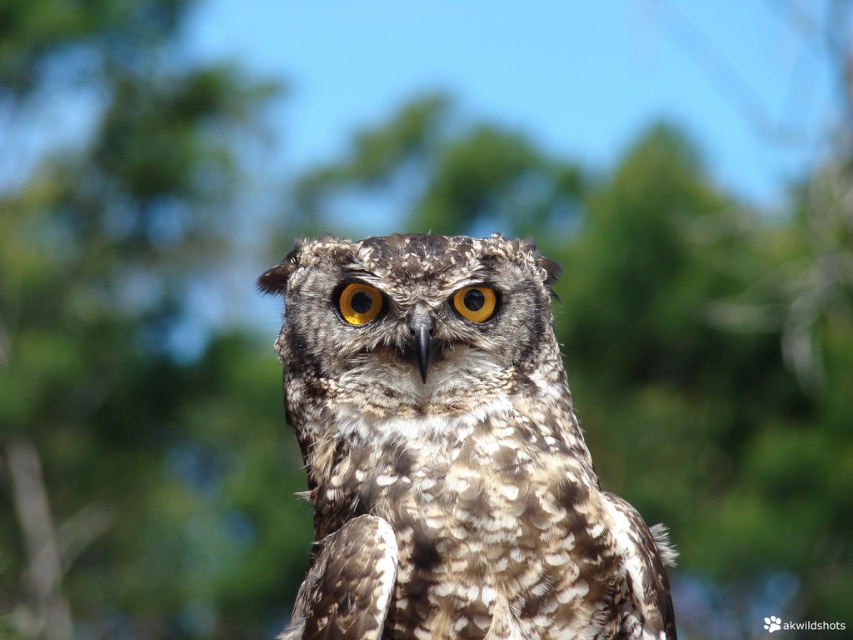
Between speckled feathered owl at center and golden matte eye at center, which one appears on the left side from the viewer's perspective?

golden matte eye at center is more to the left.

Which is in front, point (518, 365) or point (346, 301)?

Point (518, 365) is in front.

The width and height of the screenshot is (853, 640). I want to click on speckled feathered owl at center, so click(x=451, y=454).

Is golden matte eye at center below yellow matte eye at center?

No.

Is golden matte eye at center shorter than yellow matte eye at center?

No, golden matte eye at center is not shorter than yellow matte eye at center.

This screenshot has width=853, height=640. What do you see at coordinates (358, 301) in the screenshot?
I see `golden matte eye at center` at bounding box center [358, 301].

Find the location of `golden matte eye at center`. golden matte eye at center is located at coordinates (358, 301).

Between point (467, 244) and point (479, 321), which one is positioned behind?

Positioned behind is point (467, 244).

Does speckled feathered owl at center lie in front of yellow matte eye at center?

Yes, speckled feathered owl at center is in front of yellow matte eye at center.

The image size is (853, 640). I want to click on speckled feathered owl at center, so click(x=451, y=454).